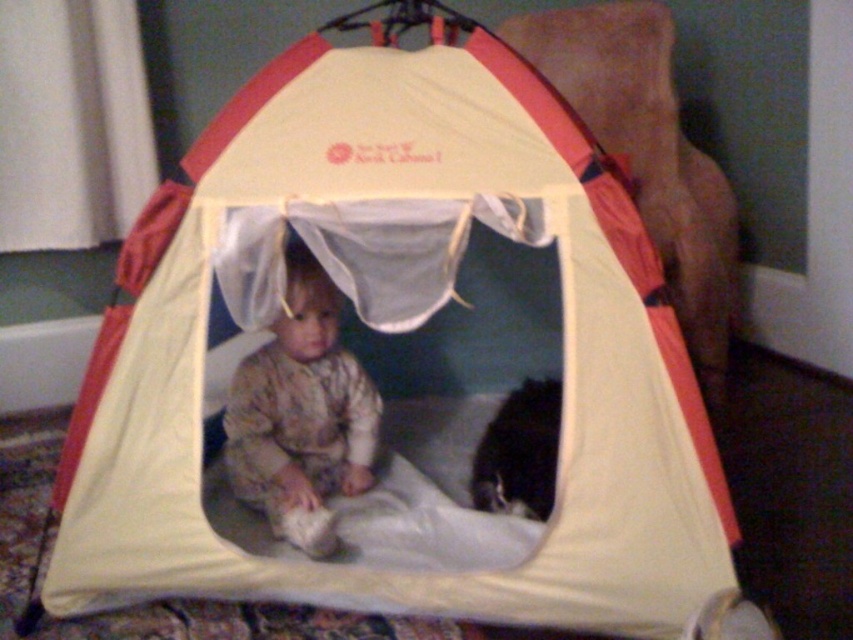
Question: Does camouflage fabric child at center come in front of black fur cat at lower right?

Choices:
 (A) no
 (B) yes

Answer: (B)

Question: Which point is closer to the camera?

Choices:
 (A) black fur cat at lower right
 (B) camouflage fabric child at center

Answer: (B)

Question: Considering the relative positions of camouflage fabric child at center and black fur cat at lower right in the image provided, where is camouflage fabric child at center located with respect to black fur cat at lower right?

Choices:
 (A) right
 (B) left

Answer: (B)

Question: Among these points, which one is farthest from the camera?

Choices:
 (A) (277, 340)
 (B) (488, 452)

Answer: (B)

Question: Where is camouflage fabric child at center located in relation to black fur cat at lower right in the image?

Choices:
 (A) below
 (B) above

Answer: (B)